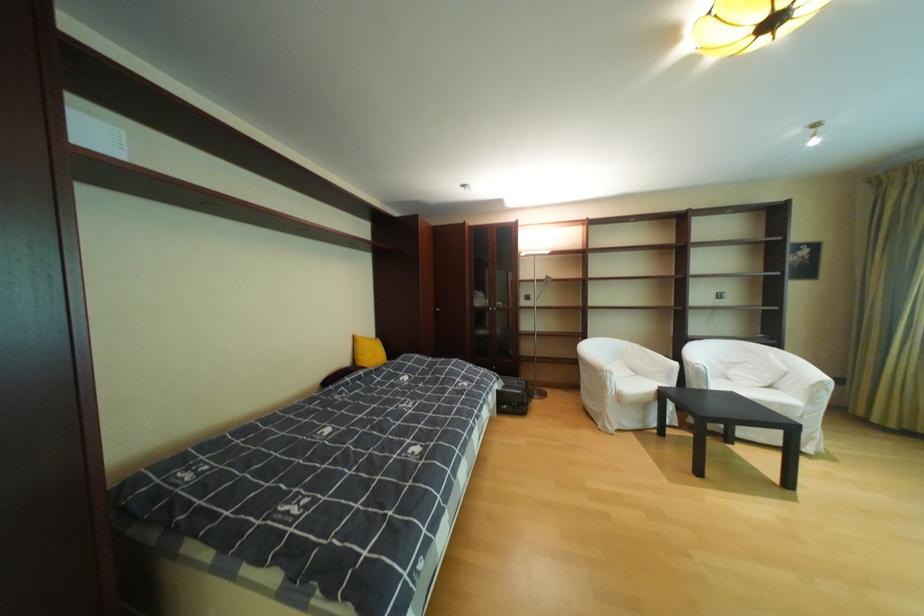
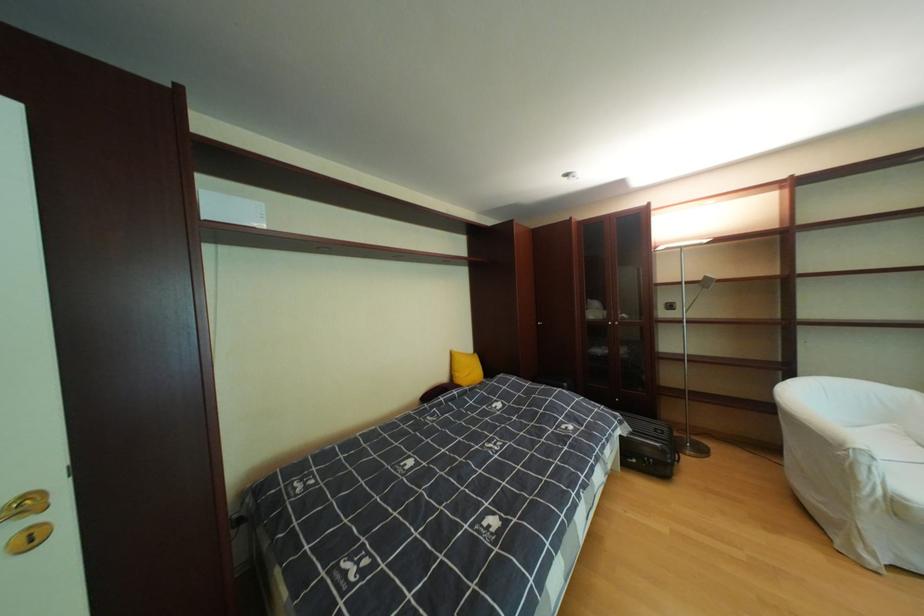
Where in the second image is the point corresponding to the point at 358,363 from the first image?

(456, 379)